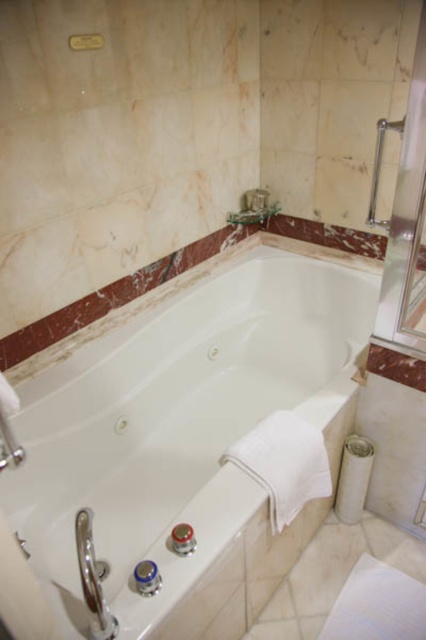
You are a contractor assessing the bathroom layout. You need to install a new shelf between the transparent glass door at upper right and the satin nickel grab bar at upper right. Which object should the shelf be placed closer to if it must be centered between them?

The shelf should be placed closer to the transparent glass door at upper right because it has a smaller width than the satin nickel grab bar at upper right, allowing for better centering between them.

You are a contractor assessing bathroom safety. You notice the transparent glass door at upper right and the satin nickel grab bar at upper right. Which object is closer to you from your current viewpoint?

The transparent glass door at upper right is closer to you than the satin nickel grab bar at upper right since it is in front of it.

You are a delivery person trying to place a 30 inch wide package between the white glossy bathtub at center and the transparent glass door at upper right. Can you fit it there?

The white glossy bathtub at center and transparent glass door at upper right are 29.98 inches apart, which is slightly less than the 30 inch width of the package. Therefore, the package cannot fit in the space between them.